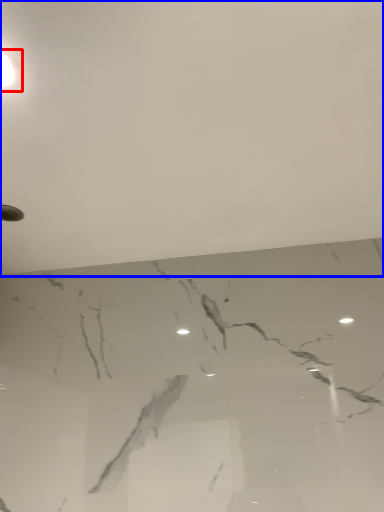
Question: Which object appears closest to the camera in this image, lamp (highlighted by a red box) or backdrop (highlighted by a blue box)?

Choices:
 (A) lamp
 (B) backdrop

Answer: (B)